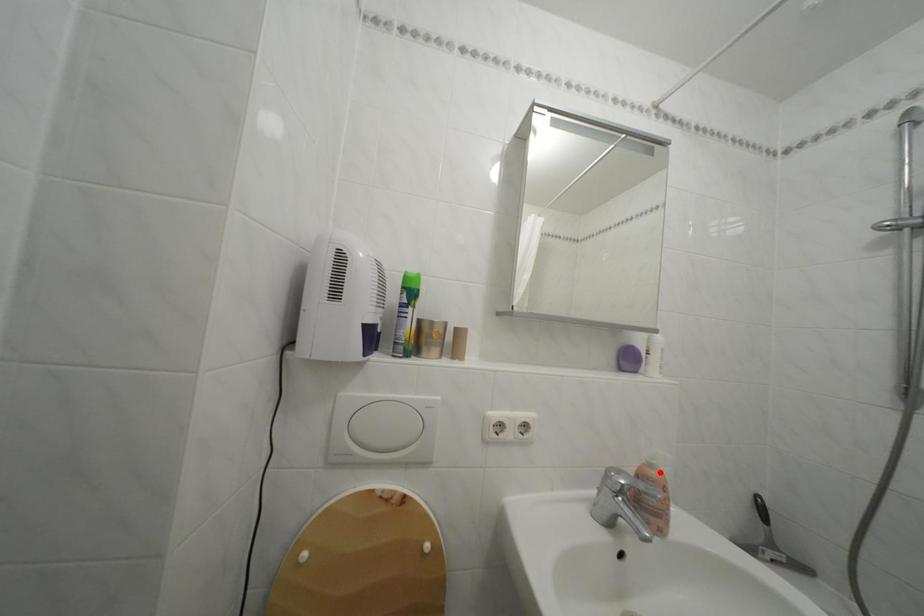
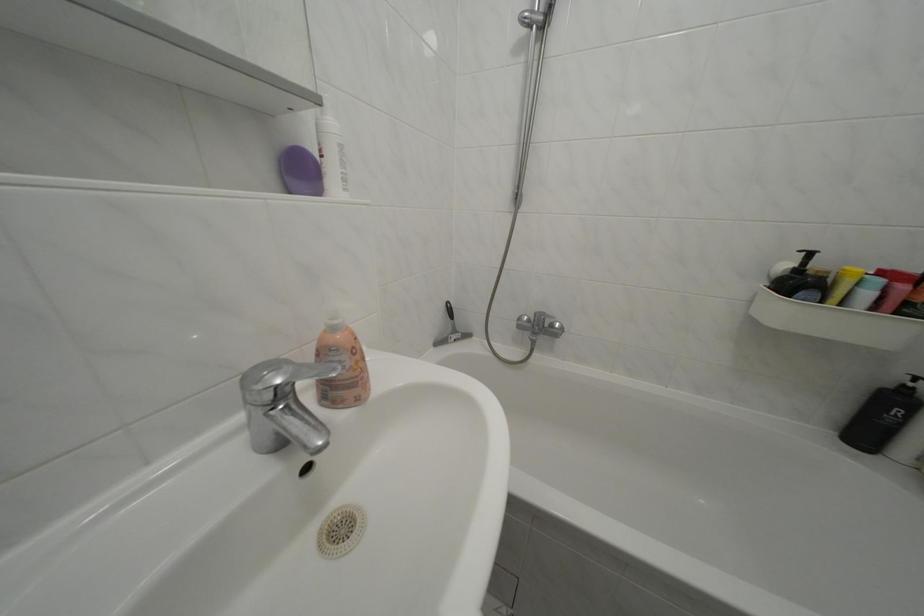
Question: I am providing you with two images of the same scene from different viewpoints. A red point is marked on the first image. At the location where the point appears in image 1, is it still visible in image 2?

Choices:
 (A) Yes
 (B) No

Answer: (A)